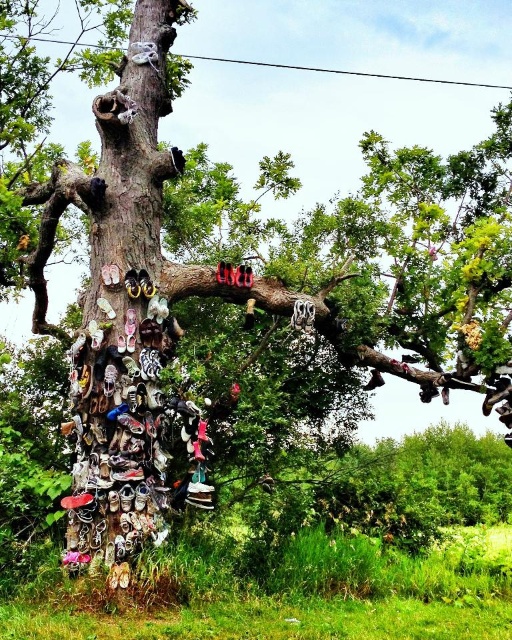
You are looking at the tree with shoes hanging on it. There are two points marked on the tree, point A at coordinates point(195, 422) and point B at coordinates point(379, 381). Which point is closer to you?

Point point(195, 422) is closer to the camera than point(379, 381), so point A is closer to you.

You are a delivery person trying to deliver a package to the shiny black sandals at left and the shiny black shoe at upper right. Since the package is too big to split, you can only deliver it to one. Which one should you choose based on their sizes?

The shiny black sandals at left has a larger size compared to the shiny black shoe at upper right, so you should deliver the package to the shiny black sandals at left because it is bigger and can accommodate the package better.

You are a delivery person trying to reach a package placed on the tree. You notice two items, the shiny black sandals at left and the shiny black shoe at upper right. Which item is positioned higher up on the tree?

The shiny black sandals at left is taller than the shiny black shoe at upper right, so the shiny black sandals at left is positioned higher up on the tree.